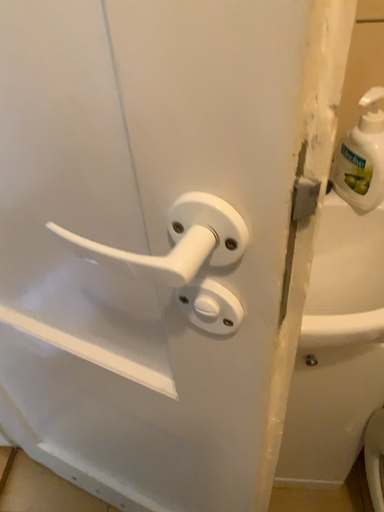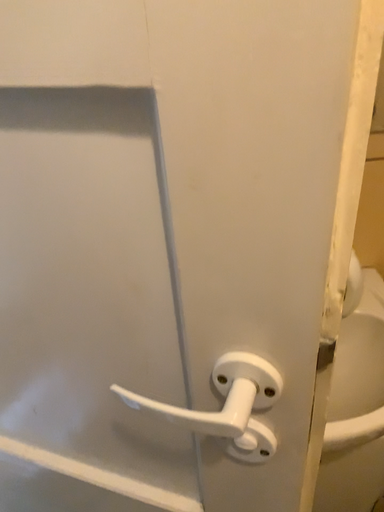
Question: Which way did the camera rotate in the video?

Choices:
 (A) rotated downward
 (B) rotated upward

Answer: (B)